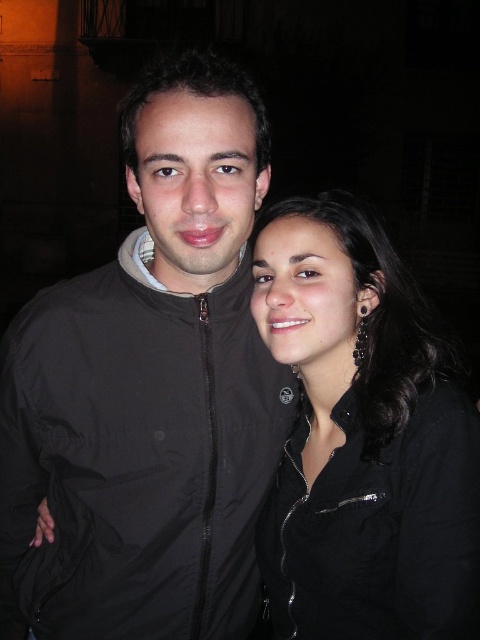
Image resolution: width=480 pixels, height=640 pixels. I want to click on black matte jacket at center, so click(151, 388).

Does black matte jacket at center appear over black matte shirt at right?

Correct, black matte jacket at center is located above black matte shirt at right.

Does point (143, 364) come behind point (302, 202)?

No, (143, 364) is in front of (302, 202).

Image resolution: width=480 pixels, height=640 pixels. I want to click on black matte jacket at center, so click(151, 388).